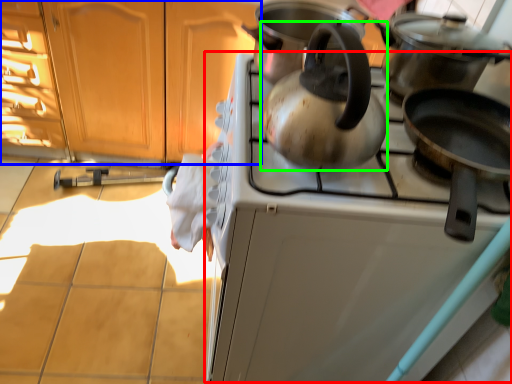
Question: Which is farther away from oven (highlighted by a red box)? cabinetry (highlighted by a blue box) or kettle (highlighted by a green box)?

Choices:
 (A) cabinetry
 (B) kettle

Answer: (A)